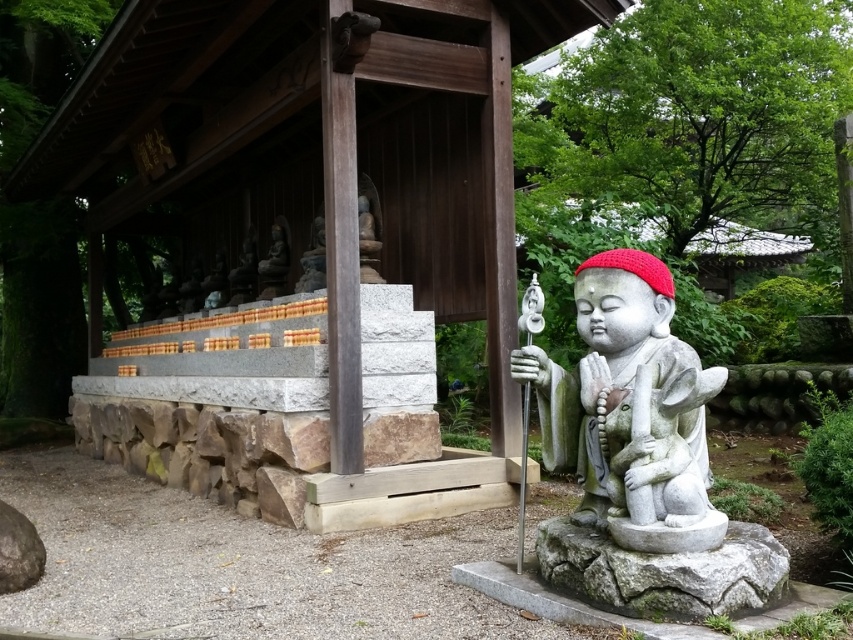
Question: Among these objects, which one is nearest to the camera?

Choices:
 (A) white stone statue at center
 (B) gray stone statue at lower right

Answer: (B)

Question: In this image, where is white stone statue at center located relative to gray stone statue at lower right?

Choices:
 (A) right
 (B) left

Answer: (B)

Question: Does white stone statue at center have a lesser width compared to gray stone statue at lower right?

Choices:
 (A) no
 (B) yes

Answer: (B)

Question: Can you confirm if white stone statue at center is wider than gray stone statue at lower right?

Choices:
 (A) no
 (B) yes

Answer: (A)

Question: Among these objects, which one is nearest to the camera?

Choices:
 (A) white stone statue at center
 (B) gray stone statue at lower right

Answer: (B)

Question: Which object appears closest to the camera in this image?

Choices:
 (A) gray stone statue at lower right
 (B) white stone statue at center

Answer: (A)